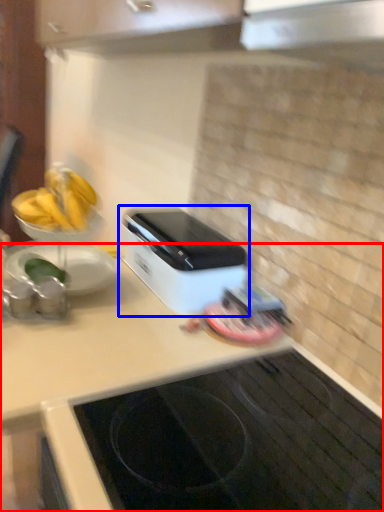
Question: Among these objects, which one is nearest to the camera, countertop (highlighted by a red box) or home appliance (highlighted by a blue box)?

Choices:
 (A) countertop
 (B) home appliance

Answer: (A)